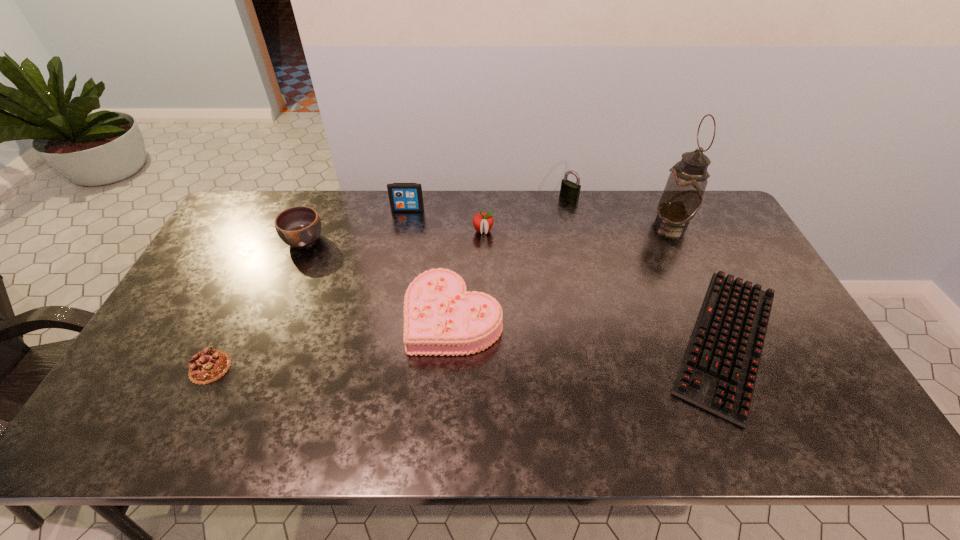
You are a GUI agent. You are given a task and a screenshot of the screen. Output one action in this format:
    pyautogui.click(x=<x>, y=<y>)
    Task: Click on the tallest object
    
    Given the screenshot: What is the action you would take?
    pyautogui.click(x=683, y=194)

The image size is (960, 540). I want to click on the farthest object, so click(569, 190).

Locate an element on the screen. The height and width of the screenshot is (540, 960). the third object from right to left is located at coordinates (569, 190).

Image resolution: width=960 pixels, height=540 pixels. In order to click on iPod in this screenshot , I will do [x=404, y=197].

Where is `bowl`? The image size is (960, 540). bowl is located at coordinates (300, 226).

The height and width of the screenshot is (540, 960). Identify the location of apple. (483, 222).

Image resolution: width=960 pixels, height=540 pixels. Find the location of `cake`. cake is located at coordinates (441, 318).

This screenshot has width=960, height=540. Find the location of `chocolate cake`. chocolate cake is located at coordinates (207, 366).

Where is `the shortest object`? the shortest object is located at coordinates (718, 373).

The height and width of the screenshot is (540, 960). In order to click on vacant position located on the back of the oil lamp in this screenshot , I will do `click(657, 191)`.